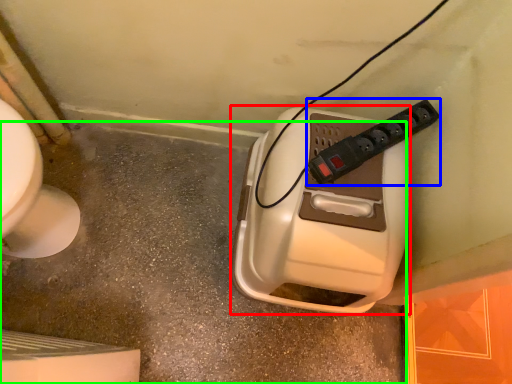
Question: Considering the real-world distances, which object is closest to hand dryer (highlighted by a red box)? power plugs and sockets (highlighted by a blue box) or concrete (highlighted by a green box).

Choices:
 (A) power plugs and sockets
 (B) concrete

Answer: (A)